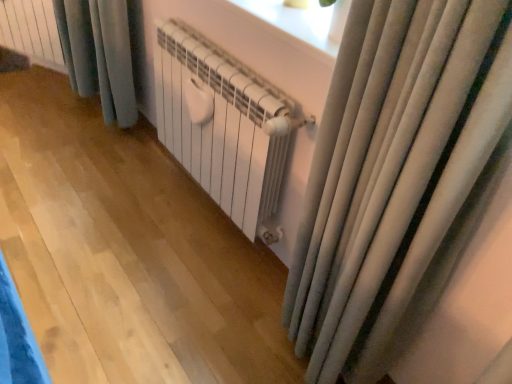
Question: In which direction should I rotate to look at white matte radiator at center, which ranks as the 2th radiator in top-to-bottom order?

Choices:
 (A) right
 (B) left

Answer: (B)

Question: Considering the relative sizes of white matte radiator at upper left, placed as the 2th radiator when sorted from bottom to top, and white matte radiator at center, positioned as the first radiator in bottom-to-top order, in the image provided, is white matte radiator at upper left, placed as the 2th radiator when sorted from bottom to top, taller than white matte radiator at center, positioned as the first radiator in bottom-to-top order,?

Choices:
 (A) yes
 (B) no

Answer: (B)

Question: Is white matte radiator at upper left, positioned as the first radiator in back-to-front order, in contact with white matte radiator at center, arranged as the 1th radiator when viewed from the right?

Choices:
 (A) no
 (B) yes

Answer: (A)

Question: Can you confirm if white matte radiator at upper left, which is the 2th radiator from front to back, is wider than white matte radiator at center, which ranks as the 2th radiator in top-to-bottom order?

Choices:
 (A) no
 (B) yes

Answer: (A)

Question: From the image's perspective, is white matte radiator at upper left, which is the 2th radiator from front to back, below white matte radiator at center, which ranks as the 2th radiator in top-to-bottom order?

Choices:
 (A) yes
 (B) no

Answer: (B)

Question: Considering the relative positions of white matte radiator at upper left, positioned as the first radiator in back-to-front order, and white matte radiator at center, marked as the first radiator in a front-to-back arrangement, in the image provided, is white matte radiator at upper left, positioned as the first radiator in back-to-front order, in front of white matte radiator at center, marked as the first radiator in a front-to-back arrangement,?

Choices:
 (A) yes
 (B) no

Answer: (B)

Question: Is white matte radiator at upper left, positioned as the 1th radiator in top-to-bottom order, not close to white matte radiator at center, placed as the 2th radiator when sorted from back to front?

Choices:
 (A) yes
 (B) no

Answer: (A)

Question: Is white matte radiator at center, positioned as the first radiator in bottom-to-top order, placed right next to white matte radiator at upper left, placed as the 2th radiator when sorted from bottom to top?

Choices:
 (A) yes
 (B) no

Answer: (B)

Question: Does white matte radiator at center, which ranks as the 2th radiator in top-to-bottom order, have a greater width compared to white matte radiator at upper left, positioned as the first radiator in back-to-front order?

Choices:
 (A) no
 (B) yes

Answer: (B)

Question: Is white matte radiator at center, which ranks as the 2th radiator in top-to-bottom order, taller than white matte radiator at upper left, positioned as the 1th radiator in top-to-bottom order?

Choices:
 (A) no
 (B) yes

Answer: (B)

Question: Is white matte radiator at center, arranged as the 1th radiator when viewed from the right, at the right side of white matte radiator at upper left, positioned as the 1th radiator in top-to-bottom order?

Choices:
 (A) yes
 (B) no

Answer: (A)

Question: From the image's perspective, is white matte radiator at center, placed as the 2th radiator when sorted from back to front, below white matte radiator at upper left, positioned as the 1th radiator in top-to-bottom order?

Choices:
 (A) yes
 (B) no

Answer: (A)

Question: Would you consider white matte radiator at center, marked as the first radiator in a front-to-back arrangement, to be distant from white matte radiator at upper left, placed as the 2th radiator when sorted from bottom to top?

Choices:
 (A) yes
 (B) no

Answer: (A)

Question: Considering the positions of point (44, 0) and point (182, 81), is point (44, 0) closer or farther from the camera than point (182, 81)?

Choices:
 (A) closer
 (B) farther

Answer: (B)